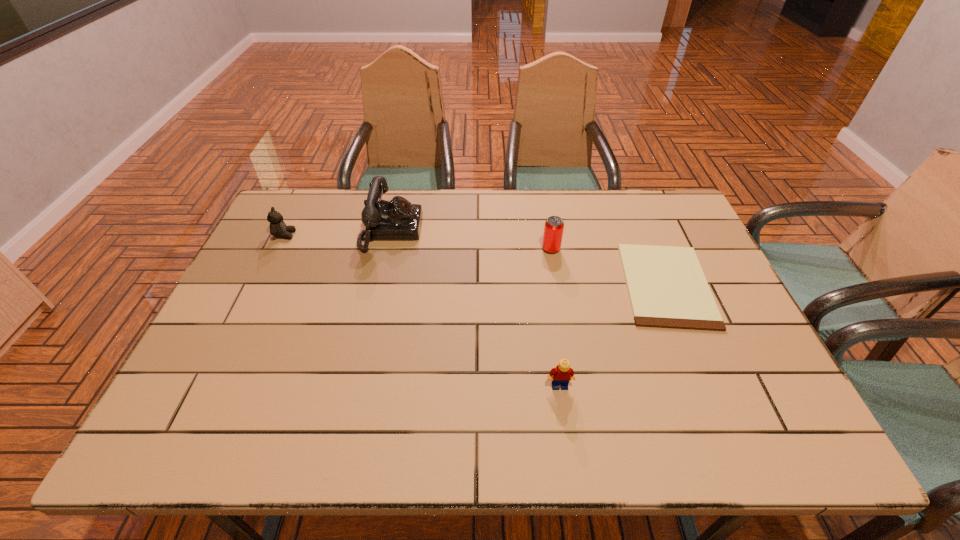
At what (x,y) coordinates should I click in order to perform the action: click on free space located 0.060m on the front-facing side of the Lego. Please return your answer as a coordinate pair (x, y). The image size is (960, 540). Looking at the image, I should click on (564, 415).

Where is `vacant point located on the left of the rightmost object`? This screenshot has height=540, width=960. vacant point located on the left of the rightmost object is located at coordinates (605, 285).

Locate an element on the screen. telephone that is positioned at the far edge is located at coordinates (397, 219).

This screenshot has height=540, width=960. I want to click on teddy bear that is at the far edge, so click(x=278, y=228).

This screenshot has height=540, width=960. In order to click on object that is positioned at the left edge in this screenshot , I will do [278, 228].

In order to click on object situated at the right edge in this screenshot , I will do `click(667, 288)`.

The image size is (960, 540). Find the location of `object located in the far left corner section of the desktop`. object located in the far left corner section of the desktop is located at coordinates (278, 228).

In the image, there is a desktop. At what (x,y) coordinates should I click in order to perform the action: click on vacant area at the far edge. Please return your answer as a coordinate pair (x, y). This screenshot has height=540, width=960. Looking at the image, I should click on (580, 202).

Identify the location of free space at the near edge of the desktop. (691, 416).

In the image, there is a desktop. Where is `vacant space at the left edge`? Image resolution: width=960 pixels, height=540 pixels. vacant space at the left edge is located at coordinates (271, 332).